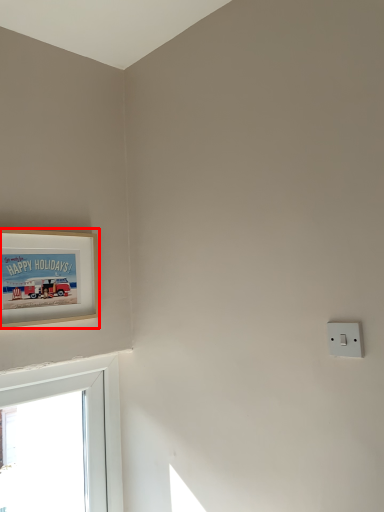
Question: From the image's perspective, considering the relative positions of picture frame (annotated by the red box) and light switch in the image provided, where is picture frame (annotated by the red box) located with respect to the staircase?

Choices:
 (A) below
 (B) above

Answer: (B)